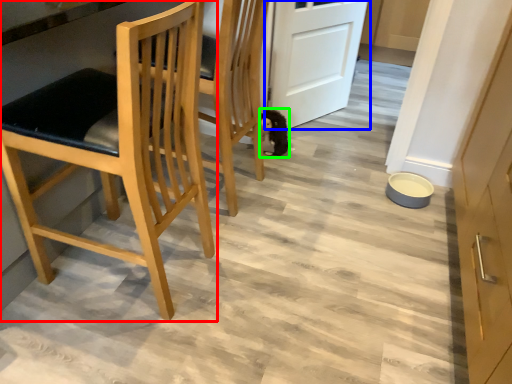
Question: Which object is positioned closest to chair (highlighted by a red box)? Select from door (highlighted by a blue box) and animal (highlighted by a green box).

Choices:
 (A) door
 (B) animal

Answer: (B)